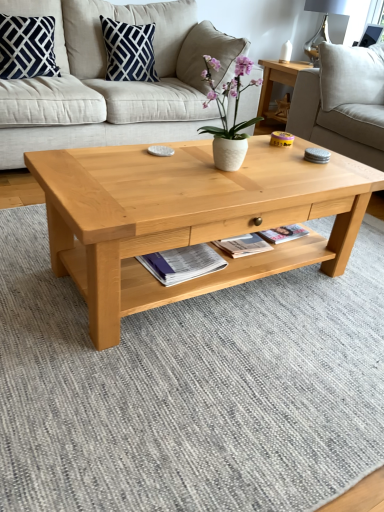
Question: Would you say navy blue cotton pillow at upper left, which is the 1th pillow in left-to-right order, is to the left or to the right of beige fabric couch at center, arranged as the second studio couch when viewed from the right, in the picture?

Choices:
 (A) right
 (B) left

Answer: (B)

Question: Considering their positions, is navy blue cotton pillow at upper left, which is the 1th pillow in left-to-right order, located in front of or behind beige fabric couch at center, which ranks as the 1th studio couch in left-to-right order?

Choices:
 (A) behind
 (B) front

Answer: (A)

Question: Which of these objects is positioned farthest from the navy blue cotton pillow at upper center, the 1th pillow positioned from the right?

Choices:
 (A) white ceramic vase at center
 (B) matte paper magazine at center
 (C) beige fabric couch at center, which ranks as the 1th studio couch in left-to-right order
 (D) navy blue cotton pillow at upper left, which is the 1th pillow in left-to-right order
 (E) light beige fabric studio couch at upper right, positioned as the 2th studio couch in left-to-right order

Answer: (B)

Question: Considering the real-world distances, which object is farthest from the matte paper magazine at center?

Choices:
 (A) beige fabric couch at center, which ranks as the 1th studio couch in left-to-right order
 (B) light beige fabric studio couch at upper right, positioned as the 2th studio couch in left-to-right order
 (C) metallic silver lamp at upper right
 (D) white ceramic vase at center
 (E) light brown wood coffee table at center

Answer: (C)